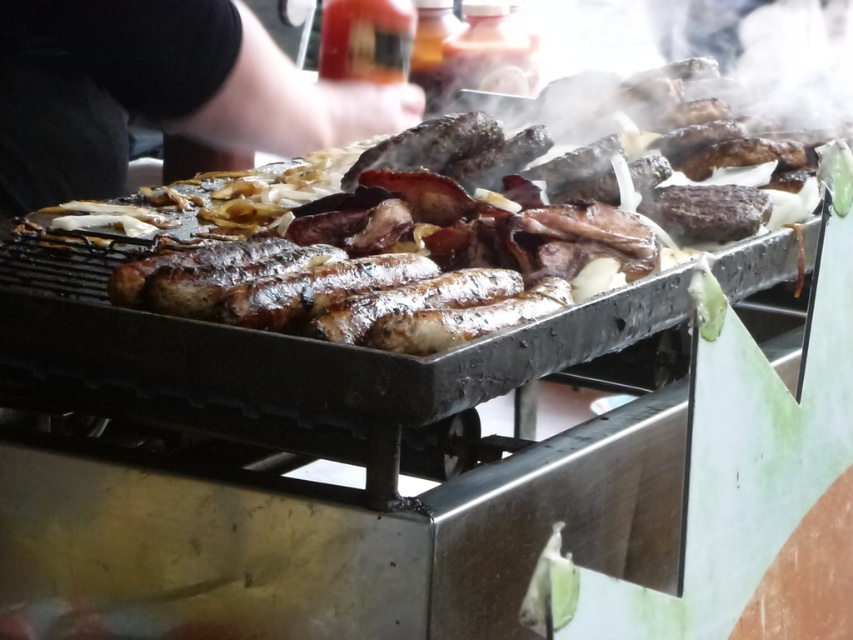
You are a chef preparing a meal and need to know which item is bigger between the shiny brown meat at center and the black fabric arm at upper left. Can you tell me which one is larger?

The shiny brown meat at center is larger in size than the black fabric arm at upper left.

You are a chef preparing a meal and need to know the height of the shiny brown meat at center compared to the black fabric arm at upper left. Can you determine which is taller?

The shiny brown meat at center is much taller than the black fabric arm at upper left.

You are a chef preparing a meal and need to reach for an ingredient. You see the shiny brown meat at center and the black fabric arm at upper left. Which object is closer to you?

The shiny brown meat at center is closer to you than the black fabric arm at upper left.